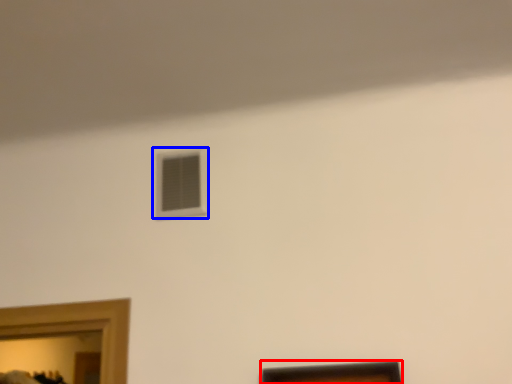
Question: Which object is further to the camera taking this photo, picture frame (highlighted by a red box) or window (highlighted by a blue box)?

Choices:
 (A) picture frame
 (B) window

Answer: (B)